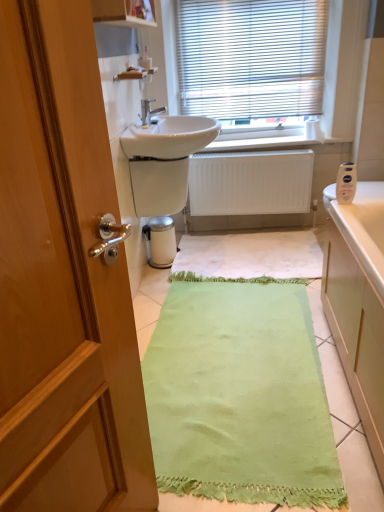
Question: From the image's perspective, would you say white matte radiator at center is positioned over white matte toilet paper at upper right?

Choices:
 (A) yes
 (B) no

Answer: (B)

Question: From the image's perspective, would you say white matte radiator at center is shown under white matte toilet paper at upper right?

Choices:
 (A) yes
 (B) no

Answer: (A)

Question: Is white matte radiator at center wider than white matte toilet paper at upper right?

Choices:
 (A) no
 (B) yes

Answer: (A)

Question: Is white matte radiator at center bigger than white matte toilet paper at upper right?

Choices:
 (A) yes
 (B) no

Answer: (A)

Question: Considering the relative sizes of white matte radiator at center and white matte toilet paper at upper right in the image provided, is white matte radiator at center taller than white matte toilet paper at upper right?

Choices:
 (A) no
 (B) yes

Answer: (B)

Question: Can white matte toilet paper at upper right be found inside white matte radiator at center?

Choices:
 (A) no
 (B) yes

Answer: (A)

Question: Can you confirm if white glossy sink at center is thinner than green fabric bath mat at center?

Choices:
 (A) yes
 (B) no

Answer: (A)

Question: From a real-world perspective, is white glossy sink at center located beneath green fabric bath mat at center?

Choices:
 (A) no
 (B) yes

Answer: (A)

Question: Considering the relative sizes of white glossy sink at center and green fabric bath mat at center in the image provided, is white glossy sink at center bigger than green fabric bath mat at center?

Choices:
 (A) yes
 (B) no

Answer: (B)

Question: Is white glossy sink at center positioned beyond the bounds of green fabric bath mat at center?

Choices:
 (A) no
 (B) yes

Answer: (B)

Question: Could you tell me if white glossy sink at center is turned towards green fabric bath mat at center?

Choices:
 (A) yes
 (B) no

Answer: (B)

Question: Can you confirm if white glossy sink at center is wider than green fabric bath mat at center?

Choices:
 (A) yes
 (B) no

Answer: (B)

Question: Is white plastic blinds at upper center facing towards matte silver faucet at center?

Choices:
 (A) yes
 (B) no

Answer: (A)